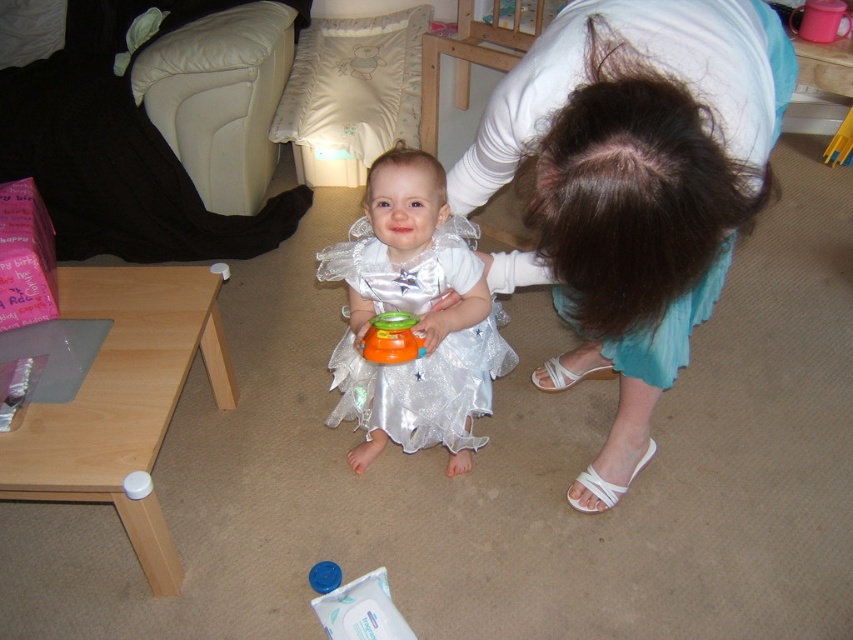
You are standing in the living room and want to pick up an object located at point (49, 113). If your arm can reach up to 7 feet, will you be able to reach it?

The point (49, 113) is 7.73 feet away from the camera, which is farther than your arm can reach. You will not be able to reach it.

You are a visitor entering the living room and want to sit on the black leather couch at upper left. Which side of the orange rubber toy at center should you go around to reach the couch?

The black leather couch at upper left is to the left of the orange rubber toy at center, so you should go around the left side of the orange rubber toy at center to reach the couch.